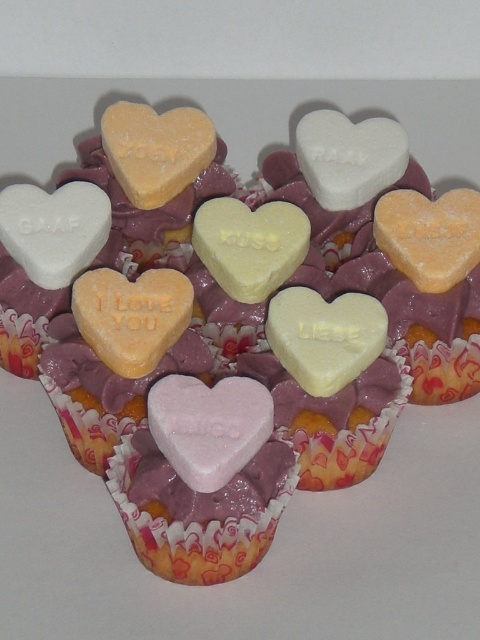
You are a baker trying to place a new heart candy on the cupcakes. You have a pink matte heart at center and a white matte heart at upper left. Which heart candy has a smaller width?

The pink matte heart at center has a smaller width than the white matte heart at upper left.

You are a person with a 1.75 meter height. You are standing in front of the cupcakes and want to read the text on the pink matte heart at center. Can you read the text clearly without bending down or moving closer?

The pink matte heart at center is 1.15 meters away from the viewer. Since the average comfortable reading distance for an adult is about 30 cm to 1 meter, the distance of 1.15 meters may make the text slightly difficult to read clearly without moving closer or adjusting your position.

You are a baker preparing cupcakes for a party. You have two hearts, the pink matte heart at center and the white matte heart at center. Which one is shorter?

The pink matte heart at center is shorter than the white matte heart at center.